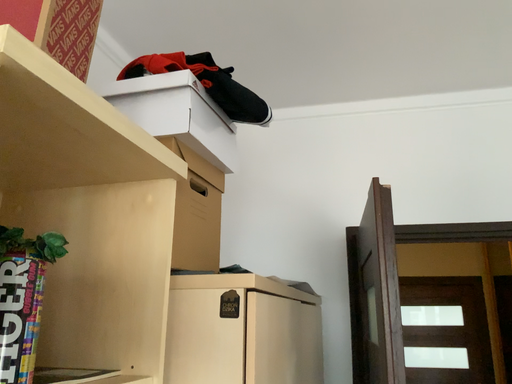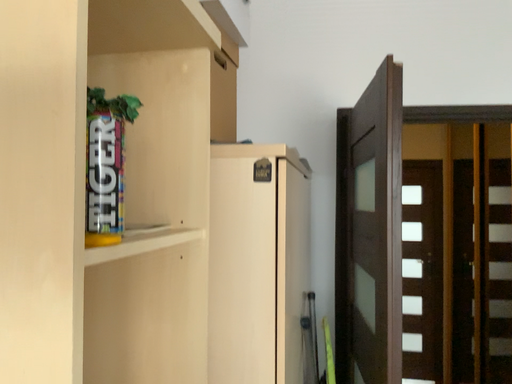
Question: Which way did the camera rotate in the video?

Choices:
 (A) rotated upward
 (B) rotated downward

Answer: (B)